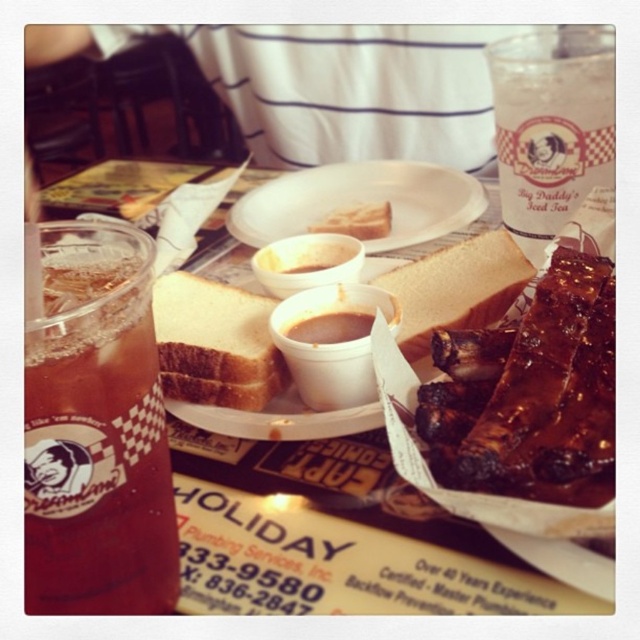
Question: Observing the image, what is the correct spatial positioning of smokey brown paste at center in reference to brown matte bread at center?

Choices:
 (A) right
 (B) left

Answer: (B)

Question: Which object is the closest to the translucent plastic plate at center?

Choices:
 (A) smokey brown glazed ribs at center
 (B) clear plastic cup at upper right
 (C) brown matte bread at center

Answer: (A)

Question: From the image, what is the correct spatial relationship of clear plastic cup at upper right in relation to slightly toasted bread at center?

Choices:
 (A) right
 (B) left

Answer: (A)

Question: Which of the following is the farthest from the observer?

Choices:
 (A) (141, 259)
 (B) (182, 419)

Answer: (B)

Question: Which point appears closest to the camera in this image?

Choices:
 (A) (481, 304)
 (B) (337, 220)

Answer: (A)

Question: Does translucent plastic plate at center appear on the left side of slightly toasted bread at center?

Choices:
 (A) yes
 (B) no

Answer: (A)